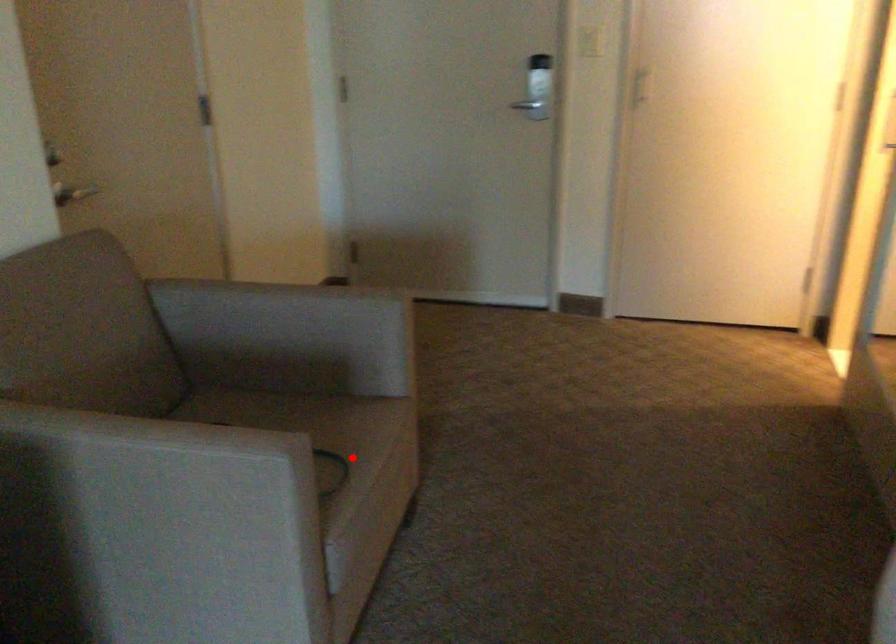
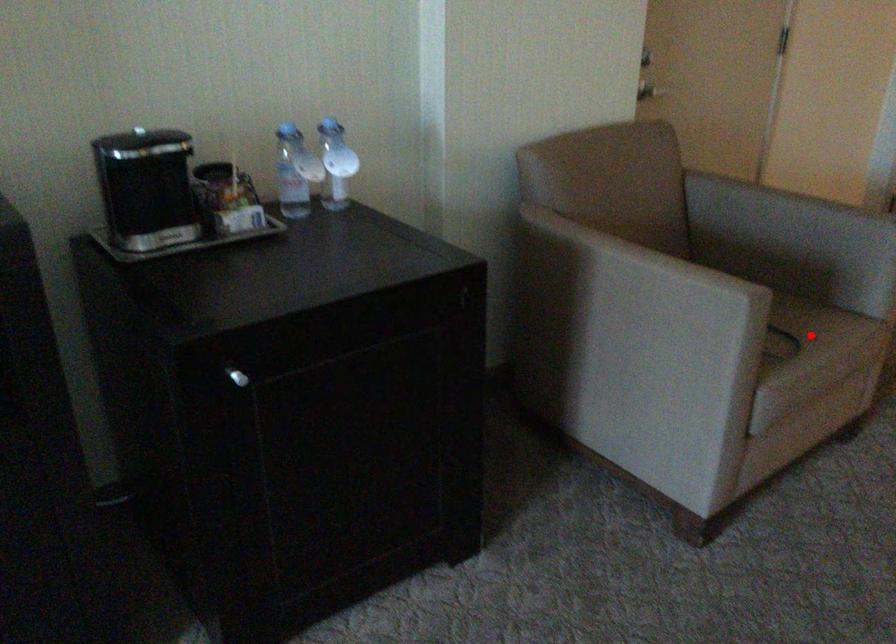
I am providing you with two images of the same scene from different viewpoints. A red point is marked on the first image and another point is marked on the second image. Does the point marked in image1 correspond to the same location as the one in image2?

Yes